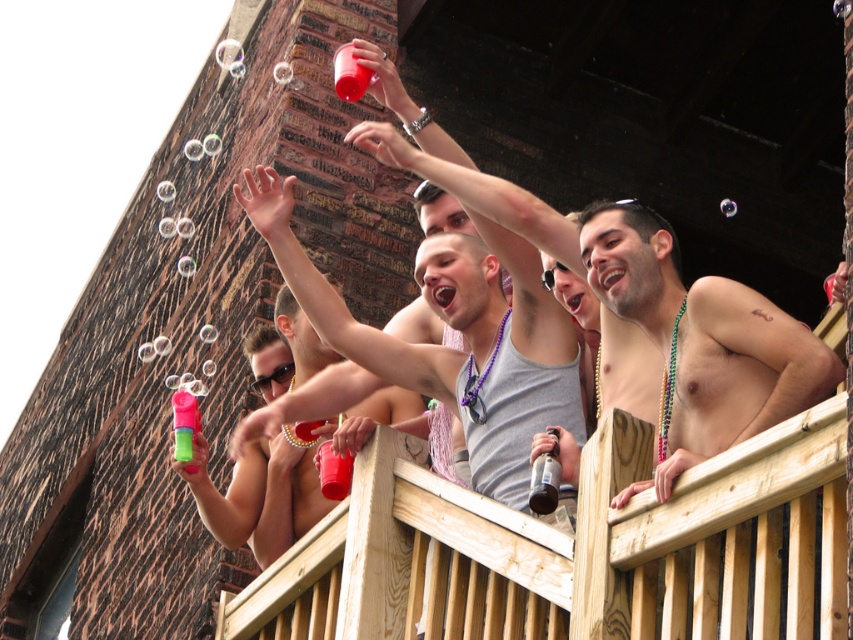
Between gray matte tank top at center and pink plastic bottle at upper center, which one is positioned higher?

gray matte tank top at center

The height and width of the screenshot is (640, 853). What do you see at coordinates (454, 328) in the screenshot? I see `gray matte tank top at center` at bounding box center [454, 328].

Does point (573, 401) lie in front of point (190, 467)?

That is True.

Identify the location of gray matte tank top at center. (454, 328).

Is shiny metallic can at center shorter than gray matte tank top at center?

Incorrect, shiny metallic can at center's height does not fall short of gray matte tank top at center's.

Can you confirm if shiny metallic can at center is taller than gray matte tank top at center?

Correct, shiny metallic can at center is much taller as gray matte tank top at center.

Between point (779, 346) and point (375, 328), which one is positioned behind?

Positioned behind is point (375, 328).

At what (x,y) coordinates should I click in order to perform the action: click on shiny metallic can at center. Please return your answer as a coordinate pair (x, y). The width and height of the screenshot is (853, 640). Looking at the image, I should click on (650, 316).

Does gray matte tank top at center have a larger size compared to translucent plastic bottle at center?

Yes.

Does gray matte tank top at center have a greater width compared to translucent plastic bottle at center?

Yes, gray matte tank top at center is wider than translucent plastic bottle at center.

Who is more forward, (x=440, y=392) or (x=550, y=506)?

Positioned in front is point (x=550, y=506).

I want to click on gray matte tank top at center, so coord(454,328).